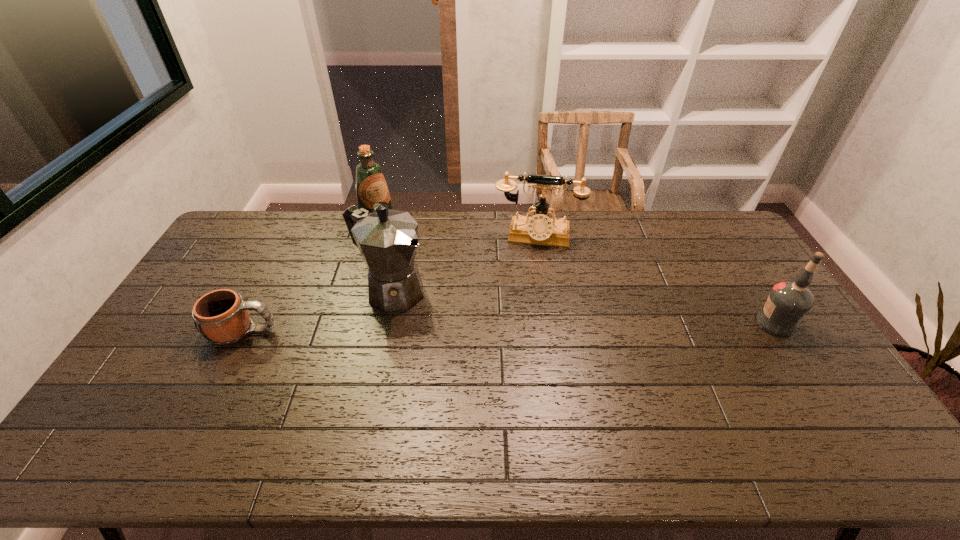
At what (x,y) coordinates should I click in order to perform the action: click on empty space between the shortest object and the olive oil. Please return your answer as a coordinate pair (x, y). Looking at the image, I should click on (312, 281).

Locate an element on the screen. The image size is (960, 540). free point between the vodka and the leftmost object is located at coordinates (510, 327).

This screenshot has width=960, height=540. I want to click on vacant region between the olive oil and the vodka, so click(x=577, y=277).

Locate an element on the screen. free space between the olive oil and the vodka is located at coordinates (577, 277).

Where is `empty location between the coffeepot and the rightmost object`? The height and width of the screenshot is (540, 960). empty location between the coffeepot and the rightmost object is located at coordinates point(583,307).

Identify which object is the fourth closest to the mug. Please provide its 2D coordinates. Your answer should be formatted as a tuple, i.e. [(x, y)], where the tuple contains the x and y coordinates of a point satisfying the conditions above.

[(788, 301)]

Where is `object that is the second closest one to the telephone`? The height and width of the screenshot is (540, 960). object that is the second closest one to the telephone is located at coordinates (371, 187).

Identify the location of free space in the image that satisfies the following two spatial constraints: 1. on the front side of the vodka; 2. on the front label of the coffeepot. The height and width of the screenshot is (540, 960). (384, 323).